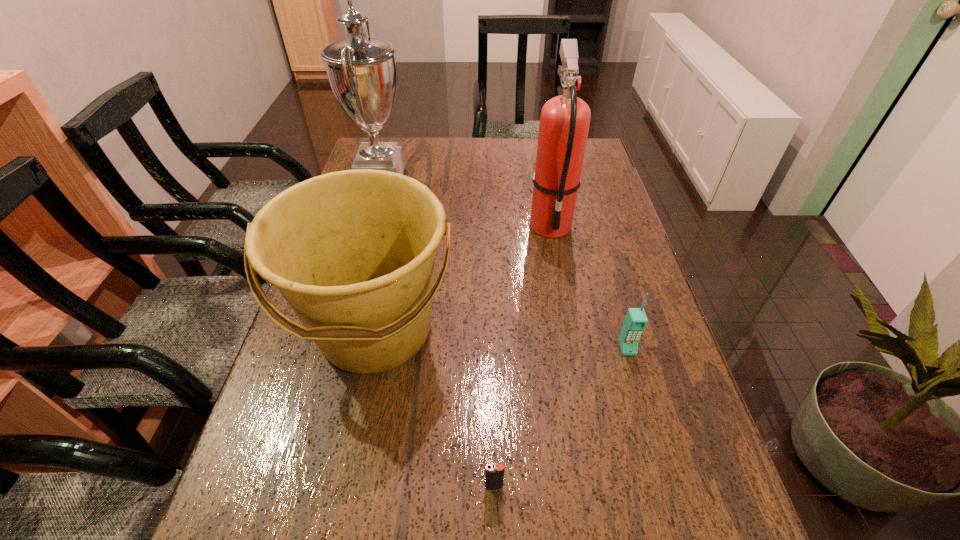
You are a GUI agent. You are given a task and a screenshot of the screen. Output one action in this format:
    pyautogui.click(x=<x>, y=<y>)
    Task: Click on the free space located 0.190m on the keypad of the rightmost object
    This screenshot has width=960, height=540.
    Given the screenshot: What is the action you would take?
    pyautogui.click(x=654, y=440)

Where is `vacant space positioned 0.180m on the back of the nearest object`? vacant space positioned 0.180m on the back of the nearest object is located at coordinates pyautogui.click(x=492, y=393).

This screenshot has height=540, width=960. Find the location of `object located in the far edge section of the desktop`. object located in the far edge section of the desktop is located at coordinates (361, 70).

You are a GUI agent. You are given a task and a screenshot of the screen. Output one action in this format:
    pyautogui.click(x=<x>, y=<y>)
    Task: Click on the trophy cup situated at the left edge
    The width and height of the screenshot is (960, 540).
    Given the screenshot: What is the action you would take?
    pos(361,70)

Find the location of `bucket that is at the left edge`. bucket that is at the left edge is located at coordinates (353, 252).

This screenshot has height=540, width=960. What are the coordinates of `fire extinguisher that is at the right edge` in the screenshot? It's located at (564, 124).

I want to click on cellular telephone that is at the right edge, so click(636, 320).

The width and height of the screenshot is (960, 540). Find the location of `object at the far left corner`. object at the far left corner is located at coordinates (361, 70).

Locate an element on the screen. The image size is (960, 540). vacant space at the far edge of the desktop is located at coordinates (469, 143).

Find the location of `free space at the left edge of the desktop`. free space at the left edge of the desktop is located at coordinates (274, 388).